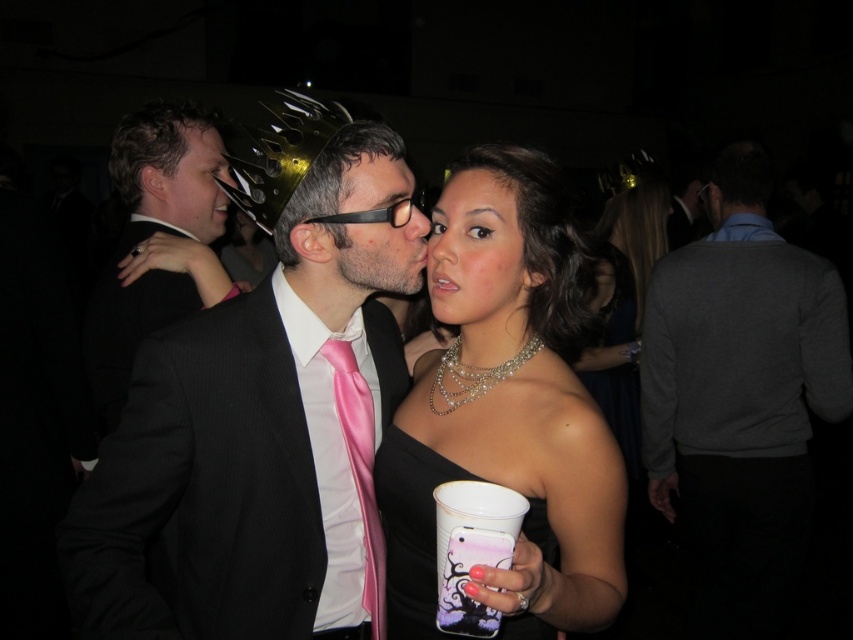
Question: Is matte black suit at center below black satin suit at left?

Choices:
 (A) yes
 (B) no

Answer: (A)

Question: Which of the following is the farthest from the observer?

Choices:
 (A) tap(502, 180)
 (B) tap(167, 186)

Answer: (B)

Question: Is matte black face at center above matte black hair at left?

Choices:
 (A) no
 (B) yes

Answer: (A)

Question: Among these objects, which one is nearest to the camera?

Choices:
 (A) smooth skin at center
 (B) matte black face at center
 (C) smooth skin face at center
 (D) black satin dress at lower center

Answer: (B)

Question: Can you confirm if matte black suit at center is smaller than black satin suit at left?

Choices:
 (A) no
 (B) yes

Answer: (B)

Question: Estimate the real-world distances between objects in this image. Which object is farther from the matte black face at center?

Choices:
 (A) gray sweater at center
 (B) matte black hair at left

Answer: (A)